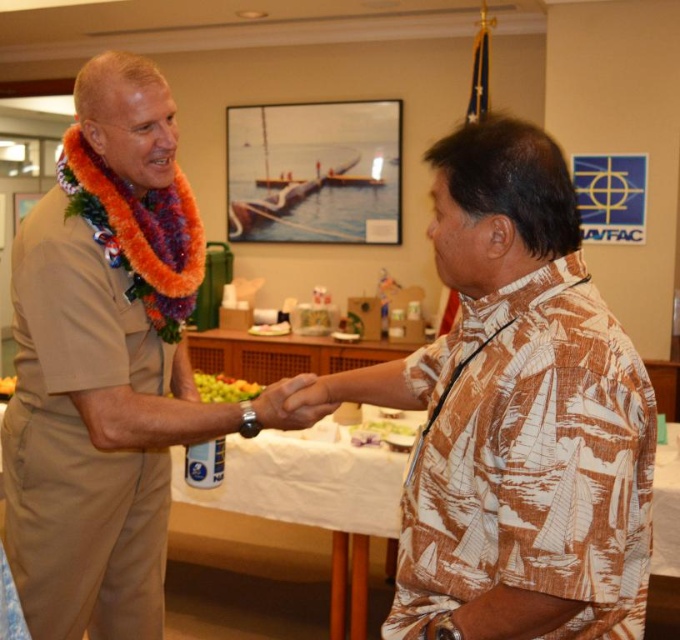
Question: Estimate the real-world distances between objects in this image. Which object is closer to the smooth skin hand at center?

Choices:
 (A) brown printed shirt at right
 (B) tan uniform at center

Answer: (B)

Question: Which point is farther to the camera?

Choices:
 (A) brown printed shirt at right
 (B) tan uniform at center
 (C) smooth skin hand at center

Answer: (B)

Question: Can you confirm if brown printed shirt at right is positioned below tan uniform at center?

Choices:
 (A) yes
 (B) no

Answer: (B)

Question: In this image, where is brown printed shirt at right located relative to smooth skin hand at center?

Choices:
 (A) left
 (B) right

Answer: (B)

Question: Based on their relative distances, which object is farther from the smooth skin hand at center?

Choices:
 (A) brown printed shirt at right
 (B) tan uniform at center

Answer: (A)

Question: Does tan uniform at center lie in front of smooth skin hand at center?

Choices:
 (A) yes
 (B) no

Answer: (B)